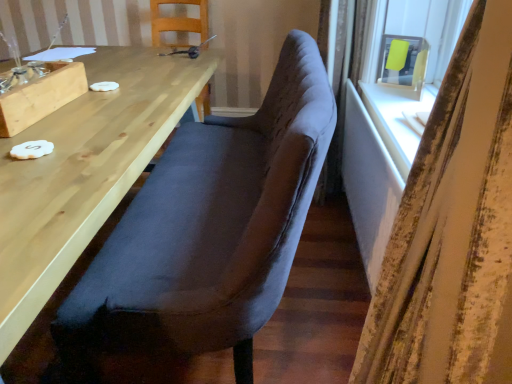
In the scene shown: What is the approximate height of white textured curtain at right?

white textured curtain at right is 3.71 feet tall.

This screenshot has width=512, height=384. What do you see at coordinates (210, 228) in the screenshot?
I see `velvet-like dark brown bench at center, acting as the first chair starting from the front` at bounding box center [210, 228].

Locate an element on the screen. velvet dark blue chair at upper center, which is the 2th chair from front to back is located at coordinates (178, 22).

In order to click on matte yellow paper at upper right in this screenshot , I will do `click(402, 61)`.

Which object is thinner, white painted wood table at right, the 2th table from the left, or matte yellow paper at upper right?

With smaller width is white painted wood table at right, the 2th table from the left.

From a real-world perspective, which object stands above the other?

matte yellow paper at upper right, from a real-world perspective.

Is white painted wood table at right, the 1th table from the right, positioned with its back to matte yellow paper at upper right?

No, white painted wood table at right, the 1th table from the right,'s orientation is not away from matte yellow paper at upper right.

Does white painted wood table at right, the 1th table from the right, appear on the left side of matte yellow paper at upper right?

Correct, you'll find white painted wood table at right, the 1th table from the right, to the left of matte yellow paper at upper right.

Does point (406, 66) come behind point (242, 354)?

Yes, point (406, 66) is behind point (242, 354).

From a real-world perspective, is matte yellow paper at upper right positioned under velvet-like dark brown bench at center, acting as the first chair starting from the front, based on gravity?

No, from a real-world perspective, matte yellow paper at upper right is not beneath velvet-like dark brown bench at center, acting as the first chair starting from the front.

From the image's perspective, would you say velvet dark blue chair at upper center, arranged as the 1th chair when viewed from the back, is shown under white painted wood table at right, the 1th table from the right?

No, from the image's perspective, velvet dark blue chair at upper center, arranged as the 1th chair when viewed from the back, is not below white painted wood table at right, the 1th table from the right.

Does point (183, 28) appear closer or farther from the camera than point (414, 121)?

Point (183, 28).

Does velvet dark blue chair at upper center, which is the 2th chair from front to back, have a larger size compared to white painted wood table at right, the 2th table from the left?

Yes, velvet dark blue chair at upper center, which is the 2th chair from front to back, is bigger than white painted wood table at right, the 2th table from the left.

How different are the orientations of velvet dark blue chair at upper center, which is the 2th chair from front to back, and white painted wood table at right, the 1th table from the right, in degrees?

The angular difference between velvet dark blue chair at upper center, which is the 2th chair from front to back, and white painted wood table at right, the 1th table from the right, is 85.2 degrees.

Is point (94, 336) more distant than point (366, 84)?

No, (94, 336) is in front of (366, 84).

From the image's perspective, which object appears higher, velvet-like dark brown bench at center, acting as the first chair starting from the front, or white painted wood table at right, the 1th table from the right?

velvet-like dark brown bench at center, acting as the first chair starting from the front.

How different are the orientations of velvet-like dark brown bench at center, acting as the first chair starting from the front, and white painted wood table at right, the 2th table from the left, in degrees?

They differ by 0.911 degrees in their facing directions.

Is velvet-like dark brown bench at center, the second chair positioned from the back, inside the boundaries of white painted wood table at right, the 1th table from the right, or outside?

velvet-like dark brown bench at center, the second chair positioned from the back, is not enclosed by white painted wood table at right, the 1th table from the right.

From the image's perspective, who appears lower, white painted wood table at right, the 1th table from the right, or white textured curtain at right?

white textured curtain at right is shown below in the image.

Based on the photo, looking at the image, does white painted wood table at right, the 1th table from the right, seem bigger or smaller compared to white textured curtain at right?

Considering their sizes, white painted wood table at right, the 1th table from the right, takes up less space than white textured curtain at right.

Which is behind, point (372, 146) or point (484, 94)?

The point (372, 146) is more distant.

Image resolution: width=512 pixels, height=384 pixels. I want to click on table lying on the right of white textured curtain at right, so click(379, 162).

Can we say matte yellow paper at upper right lies outside white textured curtain at right?

Yes, matte yellow paper at upper right is located beyond the bounds of white textured curtain at right.

Is matte yellow paper at upper right next to white textured curtain at right?

They are not placed beside each other.

Is matte yellow paper at upper right looking in the opposite direction of white textured curtain at right?

No, white textured curtain at right is not at the back of matte yellow paper at upper right.

Considering the sizes of objects matte yellow paper at upper right and white textured curtain at right in the image provided, who is shorter, matte yellow paper at upper right or white textured curtain at right?

With less height is matte yellow paper at upper right.

Looking at this image, who is shorter, white painted wood table at right, the 1th table from the right, or wooden table at left, placed as the 2th table when sorted from right to left?

With less height is white painted wood table at right, the 1th table from the right.

Is white painted wood table at right, the 1th table from the right, not within wooden table at left, which is the 1th table from left to right?

Yes, white painted wood table at right, the 1th table from the right, is outside of wooden table at left, which is the 1th table from left to right.

The width and height of the screenshot is (512, 384). What are the coordinates of `table above the white painted wood table at right, the 2th table from the left (from the image's perspective)` in the screenshot? It's located at (84, 171).

Can you confirm if white painted wood table at right, the 1th table from the right, is wider than wooden table at left, which is the 1th table from left to right?

No, white painted wood table at right, the 1th table from the right, is not wider than wooden table at left, which is the 1th table from left to right.

Locate an element on the screen. This screenshot has height=384, width=512. table that is the 2nd one when counting downward from the matte yellow paper at upper right (from the image's perspective) is located at coordinates (379, 162).

Locate an element on the screen. The height and width of the screenshot is (384, 512). window screen behind the velvet-like dark brown bench at center, acting as the first chair starting from the front is located at coordinates (402, 61).

Based on their spatial positions, is white textured curtain at right or white painted wood table at right, the 2th table from the left, closer to velvet-like dark brown bench at center, acting as the first chair starting from the front?

white painted wood table at right, the 2th table from the left, is closer to velvet-like dark brown bench at center, acting as the first chair starting from the front.

Looking at the image, which one is located closer to wooden table at left, placed as the 2th table when sorted from right to left, matte yellow paper at upper right or white painted wood table at right, the 1th table from the right?

Among the two, white painted wood table at right, the 1th table from the right, is located nearer to wooden table at left, placed as the 2th table when sorted from right to left.

When comparing their distances from wooden table at left, placed as the 2th table when sorted from right to left, does matte yellow paper at upper right or velvet dark blue chair at upper center, arranged as the 1th chair when viewed from the back, seem further?

Based on the image, velvet dark blue chair at upper center, arranged as the 1th chair when viewed from the back, appears to be further to wooden table at left, placed as the 2th table when sorted from right to left.

When comparing their distances from velvet-like dark brown bench at center, acting as the first chair starting from the front, does matte yellow paper at upper right or velvet dark blue chair at upper center, arranged as the 1th chair when viewed from the back, seem further?

Based on the image, velvet dark blue chair at upper center, arranged as the 1th chair when viewed from the back, appears to be further to velvet-like dark brown bench at center, acting as the first chair starting from the front.

Based on their spatial positions, is velvet-like dark brown bench at center, acting as the first chair starting from the front, or white painted wood table at right, the 2th table from the left, further from matte yellow paper at upper right?

velvet-like dark brown bench at center, acting as the first chair starting from the front.

Considering their positions, is matte yellow paper at upper right positioned further to white painted wood table at right, the 1th table from the right, than white textured curtain at right?

white textured curtain at right is further to white painted wood table at right, the 1th table from the right.

When comparing their distances from velvet-like dark brown bench at center, the second chair positioned from the back, does matte yellow paper at upper right or wooden table at left, which is the 1th table from left to right, seem closer?

wooden table at left, which is the 1th table from left to right, lies closer to velvet-like dark brown bench at center, the second chair positioned from the back, than the other object.

From the image, which object appears to be nearer to white painted wood table at right, the 2th table from the left, velvet-like dark brown bench at center, acting as the first chair starting from the front, or white textured curtain at right?

velvet-like dark brown bench at center, acting as the first chair starting from the front.

The image size is (512, 384). In order to click on chair between wooden table at left, which is the 1th table from left to right, and velvet dark blue chair at upper center, arranged as the 1th chair when viewed from the back, along the z-axis in this screenshot , I will do `click(210, 228)`.

Identify the location of curtain between velvet-like dark brown bench at center, acting as the first chair starting from the front, and white painted wood table at right, the 1th table from the right, in the horizontal direction. (452, 228).

This screenshot has width=512, height=384. In order to click on window screen positioned between velvet-like dark brown bench at center, acting as the first chair starting from the front, and velvet dark blue chair at upper center, which is the 2th chair from front to back, from near to far in this screenshot , I will do `click(402, 61)`.

At what (x,y) coordinates should I click in order to perform the action: click on window screen located between wooden table at left, which is the 1th table from left to right, and velvet dark blue chair at upper center, arranged as the 1th chair when viewed from the back, in the depth direction. Please return your answer as a coordinate pair (x, y). The height and width of the screenshot is (384, 512). Looking at the image, I should click on (402, 61).